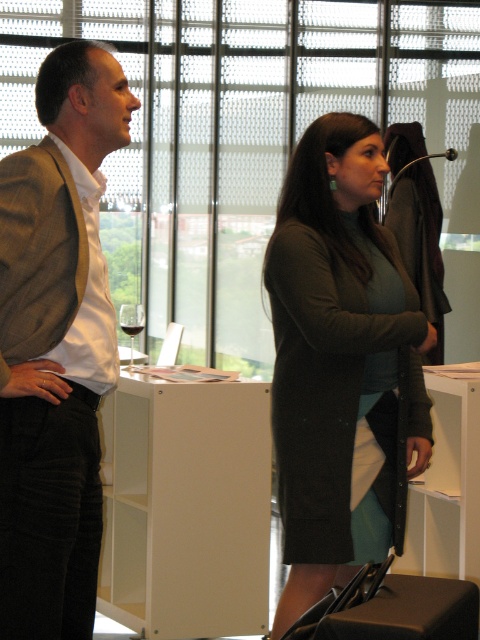
You are a photographer setting up a shoot in this room. You need to position a light source so that it illuminates both the matte brown blazer at left and the transparent glass wine glass at center. Considering their heights, which object should be placed closer to the light source to ensure proper lighting?

The matte brown blazer at left is taller than the transparent glass wine glass at center, so to ensure proper lighting, the transparent glass wine glass at center should be placed closer to the light source.

You are a guest at a party and see the dark green sweater at center and the matte brown blazer at left. Which item is closer to the floor?

The dark green sweater at center is closer to the floor because it is positioned under the matte brown blazer at left.

You are a bartender preparing drinks and need to place the translucent glass wine at center on a shelf. The shelf has a height limit of 1 meter. Can the matte brown blazer at left be placed on the same shelf without exceeding the height limit?

The matte brown blazer at left is much taller than the translucent glass wine at center. Since the shelf has a height limit of 1 meter, if the blazer is taller than the wine glass, but we don not know the exact height of the wine glass, we cannot determine if the blazer exceeds the limit. However, if the wine glass is under 1 meter, the blazer might be too tall. More information is needed.